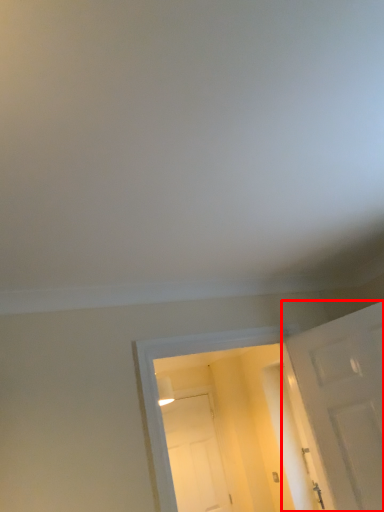
Question: From the image, what is the correct spatial relationship of door (annotated by the red box) in relation to door?

Choices:
 (A) right
 (B) left

Answer: (A)